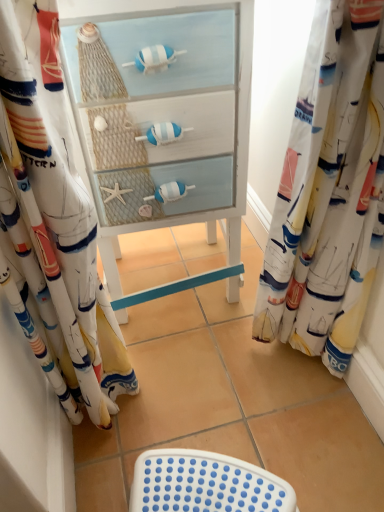
Question: Can you confirm if white painted wood cabinet at center is thinner than white sailboat-patterned fabric at left, which appears as the first curtain when viewed from the left?

Choices:
 (A) no
 (B) yes

Answer: (A)

Question: From the image's perspective, is white painted wood cabinet at center on white sailboat-patterned fabric at left, the 2th curtain when ordered from right to left?

Choices:
 (A) no
 (B) yes

Answer: (B)

Question: Is white painted wood cabinet at center surrounding white sailboat-patterned fabric at left, the 2th curtain when ordered from right to left?

Choices:
 (A) no
 (B) yes

Answer: (A)

Question: Considering the relative sizes of white painted wood cabinet at center and white sailboat-patterned fabric at left, the 2th curtain when ordered from right to left, in the image provided, is white painted wood cabinet at center shorter than white sailboat-patterned fabric at left, the 2th curtain when ordered from right to left,?

Choices:
 (A) yes
 (B) no

Answer: (A)

Question: Does white painted wood cabinet at center touch white sailboat-patterned fabric at left, the 2th curtain when ordered from right to left?

Choices:
 (A) yes
 (B) no

Answer: (B)

Question: Does point (301, 295) appear closer or farther from the camera than point (198, 56)?

Choices:
 (A) closer
 (B) farther

Answer: (B)

Question: Considering the relative positions of white sailboat-patterned fabric at right, which appears as the first curtain when viewed from the right, and white painted wood cabinet at center in the image provided, is white sailboat-patterned fabric at right, which appears as the first curtain when viewed from the right, to the left or to the right of white painted wood cabinet at center?

Choices:
 (A) left
 (B) right

Answer: (B)

Question: From a real-world perspective, is white sailboat-patterned fabric at right, which is the second curtain from left to right, above or below white painted wood cabinet at center?

Choices:
 (A) above
 (B) below

Answer: (A)

Question: In terms of height, does white sailboat-patterned fabric at right, which is the second curtain from left to right, look taller or shorter compared to white painted wood cabinet at center?

Choices:
 (A) tall
 (B) short

Answer: (A)

Question: Would you say white plastic stool at lower center is to the left or to the right of white painted wood cabinet at center in the picture?

Choices:
 (A) left
 (B) right

Answer: (B)

Question: Considering the positions of white plastic stool at lower center and white painted wood cabinet at center in the image, is white plastic stool at lower center taller or shorter than white painted wood cabinet at center?

Choices:
 (A) short
 (B) tall

Answer: (A)

Question: Considering the positions of white plastic stool at lower center and white painted wood cabinet at center in the image, is white plastic stool at lower center wider or thinner than white painted wood cabinet at center?

Choices:
 (A) thin
 (B) wide

Answer: (A)

Question: Looking at the image, does white plastic stool at lower center seem bigger or smaller compared to white painted wood cabinet at center?

Choices:
 (A) small
 (B) big

Answer: (A)

Question: Is white painted wood cabinet at center inside or outside of white plastic stool at lower center?

Choices:
 (A) outside
 (B) inside

Answer: (A)

Question: In terms of height, does white painted wood cabinet at center look taller or shorter compared to white plastic stool at lower center?

Choices:
 (A) tall
 (B) short

Answer: (A)